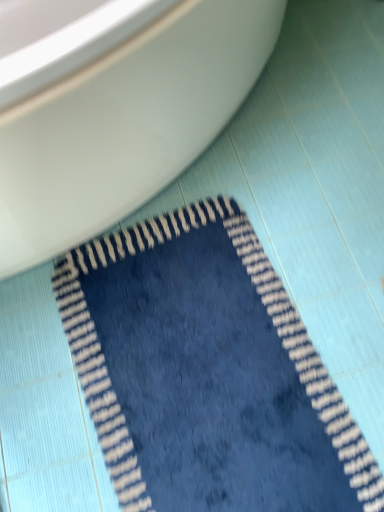
The height and width of the screenshot is (512, 384). What are the coordinates of `free location above navy blue plush rug at lower center (from a real-world perspective)` in the screenshot? It's located at (192, 362).